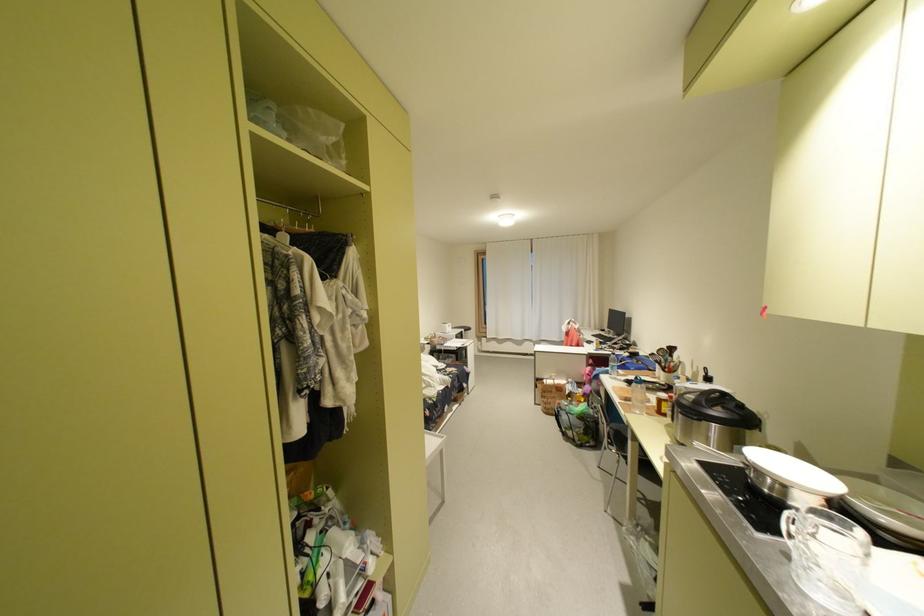
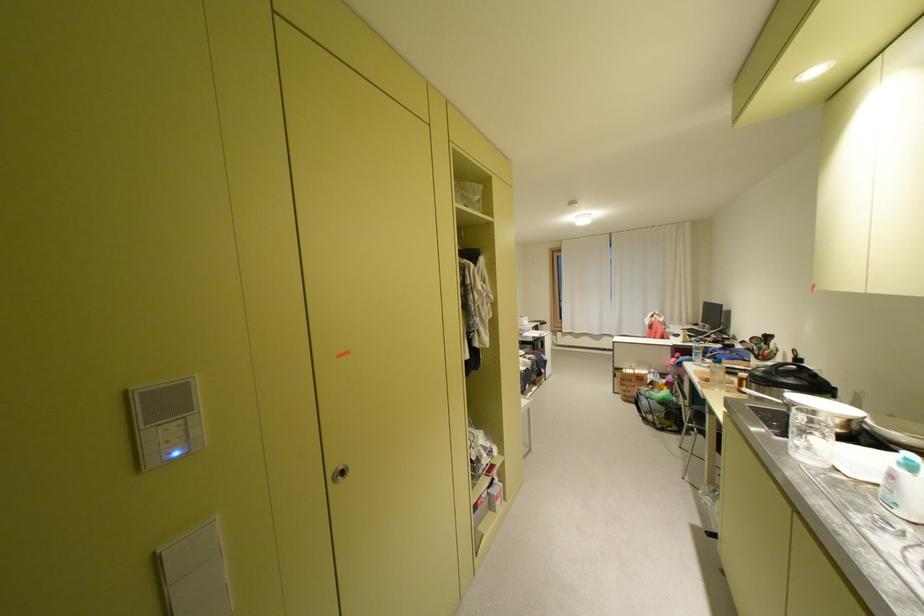
In the second image, find the point that corresponds to [736,408] in the first image.

(808, 378)